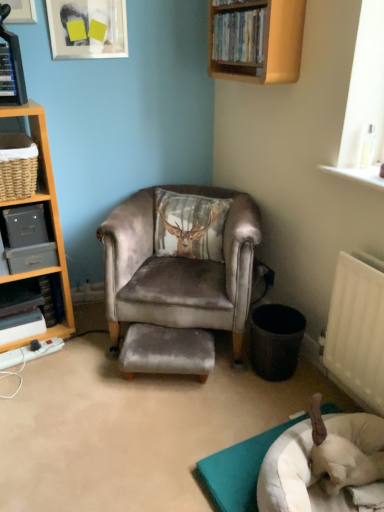
At what (x,y) coordinates should I click in order to perform the action: click on free space between velvet grey stool at center and white fabric dog bed at lower right. Please return your answer as a coordinate pair (x, y). The height and width of the screenshot is (512, 384). Looking at the image, I should click on (215, 411).